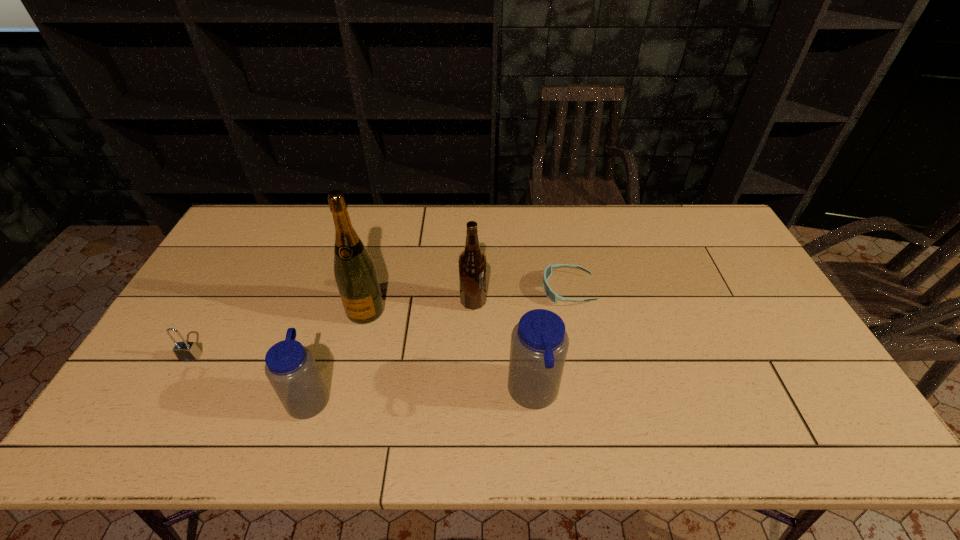
Locate an element on the screen. The width and height of the screenshot is (960, 540). vacant region located with a carrying loop on the side of the taller water bottle is located at coordinates (371, 394).

Image resolution: width=960 pixels, height=540 pixels. Identify the location of vacant space located with a carrying loop on the side of the taller water bottle. (415, 394).

Image resolution: width=960 pixels, height=540 pixels. What are the coordinates of `blank area located with a carrying loop on the side of the taller water bottle` in the screenshot? It's located at (366, 394).

You are a GUI agent. You are given a task and a screenshot of the screen. Output one action in this format:
    pyautogui.click(x=<x>, y=<y>)
    Task: Click on the vacant position located 0.400m on the label of the beer bottle
    Image resolution: width=960 pixels, height=540 pixels.
    Given the screenshot: What is the action you would take?
    pyautogui.click(x=620, y=302)

This screenshot has width=960, height=540. I want to click on vacant space located 0.100m on the front-facing side of the shortest object, so click(x=509, y=289).

You are a GUI agent. You are given a task and a screenshot of the screen. Output one action in this format:
    pyautogui.click(x=<x>, y=<y>)
    Task: Click on the free space located 0.350m on the front-facing side of the shortest object
    The width and height of the screenshot is (960, 540).
    Given the screenshot: What is the action you would take?
    pyautogui.click(x=427, y=289)

Locate an element on the screen. The image size is (960, 540). vacant area situated 0.250m on the front-facing side of the shortest object is located at coordinates (460, 289).

This screenshot has width=960, height=540. I want to click on free region located 0.110m on the shackle of the padlock, so click(x=166, y=399).

The width and height of the screenshot is (960, 540). I want to click on vacant region located 0.090m on the front-facing side of the wine bottle, so click(355, 351).

The image size is (960, 540). Find the location of `object that is at the left edge`. object that is at the left edge is located at coordinates (185, 351).